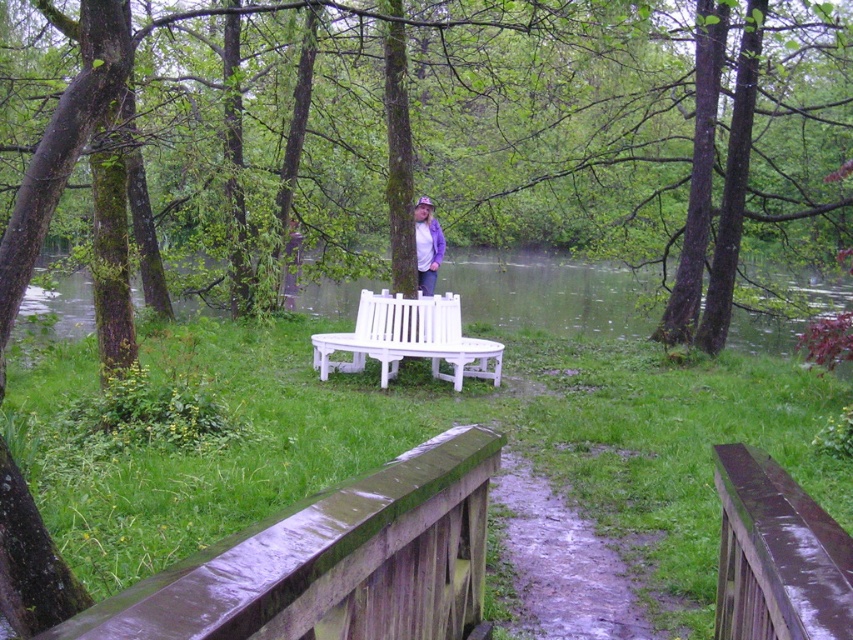
Question: Which object is positioned farthest from the white smooth bench at center?

Choices:
 (A) white wood bench at center
 (B) purple fabric jacket at center
 (C) wooden rail at lower left
 (D) brown wooden rail at lower right

Answer: (D)

Question: Which object is farther from the camera taking this photo?

Choices:
 (A) purple fabric jacket at center
 (B) white smooth bench at center
 (C) brown wooden rail at lower right

Answer: (A)

Question: Is wooden rail at lower left behind purple fabric jacket at center?

Choices:
 (A) yes
 (B) no

Answer: (B)

Question: Does wooden rail at lower left appear over brown wooden rail at lower right?

Choices:
 (A) yes
 (B) no

Answer: (A)

Question: Estimate the real-world distances between objects in this image. Which object is farther from the brown wooden rail at lower right?

Choices:
 (A) purple fabric jacket at center
 (B) wooden rail at lower left

Answer: (A)

Question: Is brown wooden rail at lower right thinner than white wood bench at center?

Choices:
 (A) no
 (B) yes

Answer: (B)